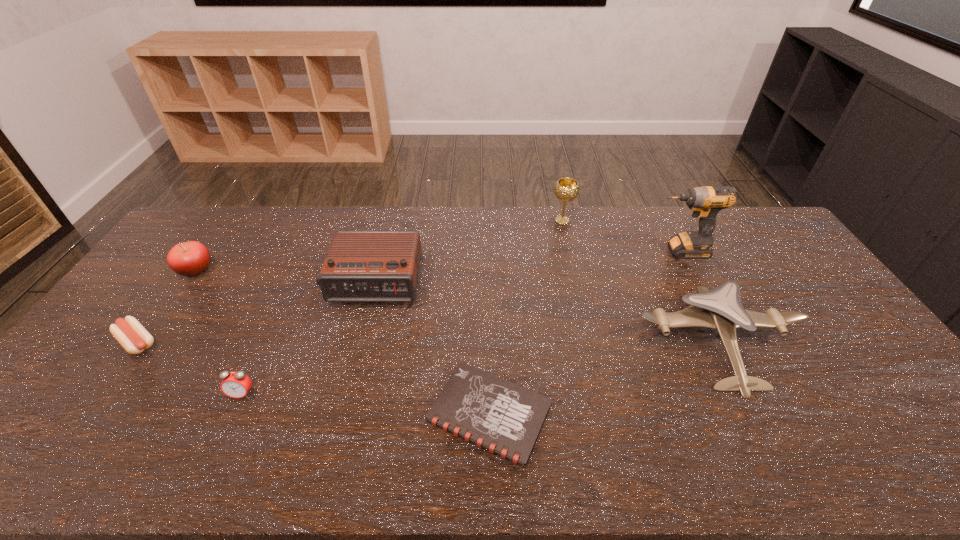
The height and width of the screenshot is (540, 960). Identify the location of free spot between the drone and the fifth object from left to right. (604, 378).

This screenshot has width=960, height=540. I want to click on vacant area between the drone and the sixth object from left to right, so click(x=640, y=281).

Locate an element on the screen. vacant point located between the notebook and the farthest object is located at coordinates (525, 317).

The width and height of the screenshot is (960, 540). In order to click on vacant space in between the fifth object from left to right and the drill in this screenshot , I will do `click(585, 332)`.

Locate an element on the screen. This screenshot has width=960, height=540. empty location between the chalice and the drone is located at coordinates (640, 281).

Image resolution: width=960 pixels, height=540 pixels. In order to click on unoccupied area between the fourth object from left to right and the second shortest object in this screenshot , I will do `click(256, 313)`.

Identify the location of object that is the second closest to the chalice. This screenshot has height=540, width=960. (721, 308).

This screenshot has height=540, width=960. What are the coordinates of `the fourth closest object relative to the radio receiver` in the screenshot? It's located at (133, 337).

Image resolution: width=960 pixels, height=540 pixels. I want to click on free spot that satisfies the following two spatial constraints: 1. with the drill bit of the drill facing forward; 2. on the front-facing side of the drone, so click(x=727, y=342).

Identify the location of vacant area in the image that satisfies the following two spatial constraints: 1. with the drill bit of the tallest object facing forward; 2. on the front-facing side of the sixth tallest object. (754, 394).